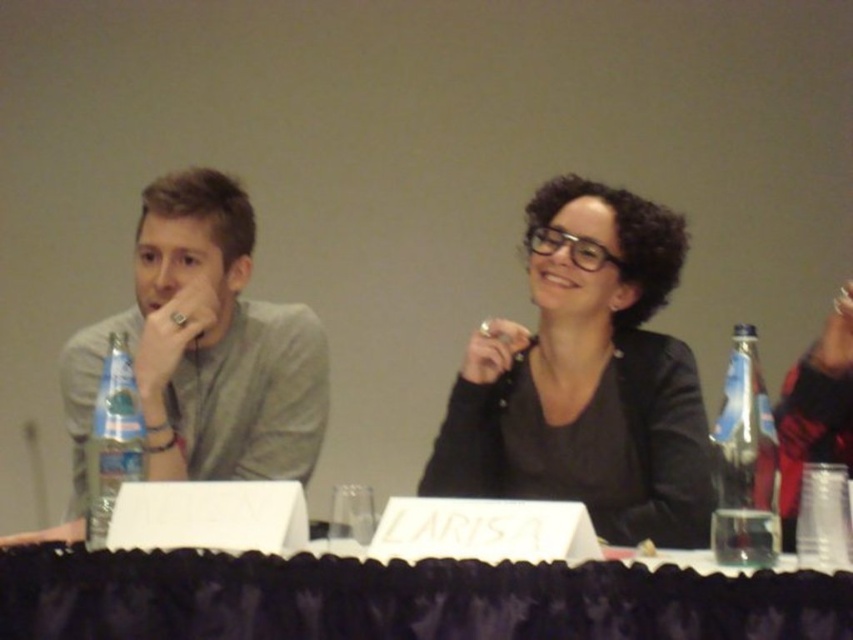
Question: Which of the following is the closest to the observer?

Choices:
 (A) (448, 474)
 (B) (96, 445)

Answer: (B)

Question: Which of these objects is positioned farthest from the clear plastic bottle at left?

Choices:
 (A) clear plastic bottle at right
 (B) black matte jacket at center
 (C) black satin tablecloth at lower center
 (D) matte gray shirt at left

Answer: (A)

Question: Is black satin tablecloth at lower center thinner than matte gray shirt at left?

Choices:
 (A) yes
 (B) no

Answer: (B)

Question: Estimate the real-world distances between objects in this image. Which object is farther from the clear plastic bottle at right?

Choices:
 (A) matte gray shirt at left
 (B) clear plastic bottle at left

Answer: (A)

Question: Is black matte jacket at center below matte gray shirt at left?

Choices:
 (A) no
 (B) yes

Answer: (A)

Question: Does black satin tablecloth at lower center have a smaller size compared to clear plastic bottle at left?

Choices:
 (A) no
 (B) yes

Answer: (A)